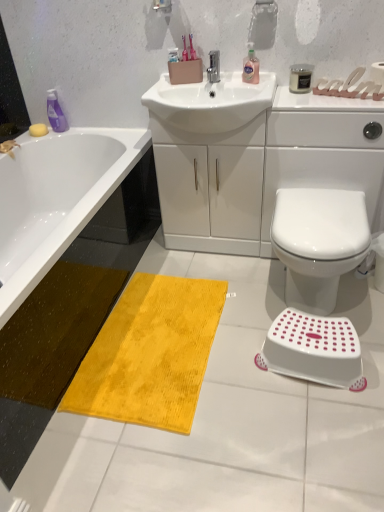
Identify the location of free location to the left of white plastic step stool at lower right. The height and width of the screenshot is (512, 384). (243, 373).